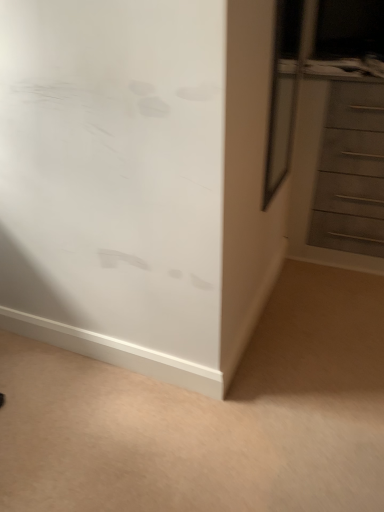
Image resolution: width=384 pixels, height=512 pixels. What do you see at coordinates (351, 172) in the screenshot? I see `matte gray chest of drawers at right` at bounding box center [351, 172].

Find the location of `matte gray chest of drawers at right`. matte gray chest of drawers at right is located at coordinates (351, 172).

Image resolution: width=384 pixels, height=512 pixels. I want to click on matte gray chest of drawers at right, so click(x=351, y=172).